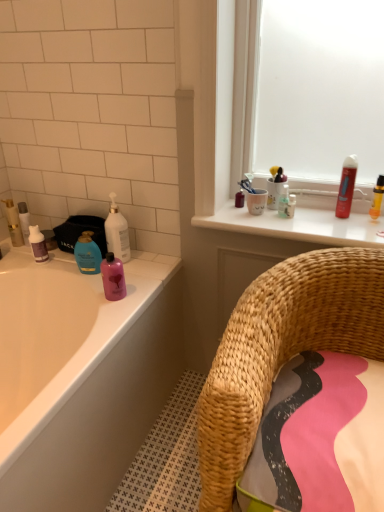
Locate an element on the screen. Image resolution: width=384 pixels, height=512 pixels. free location in front of pink glossy bottle at upper left, the first mouthwash from the bottom is located at coordinates (111, 316).